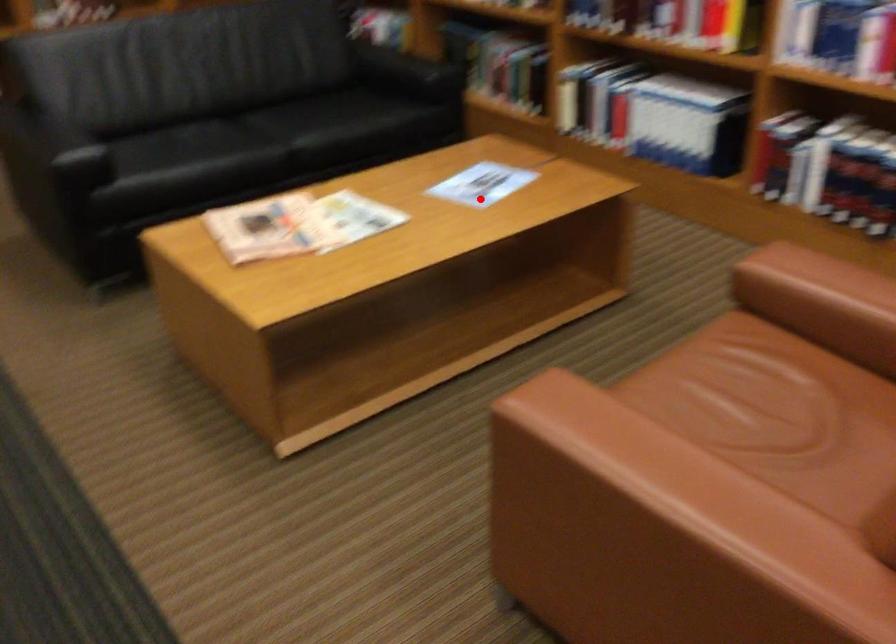
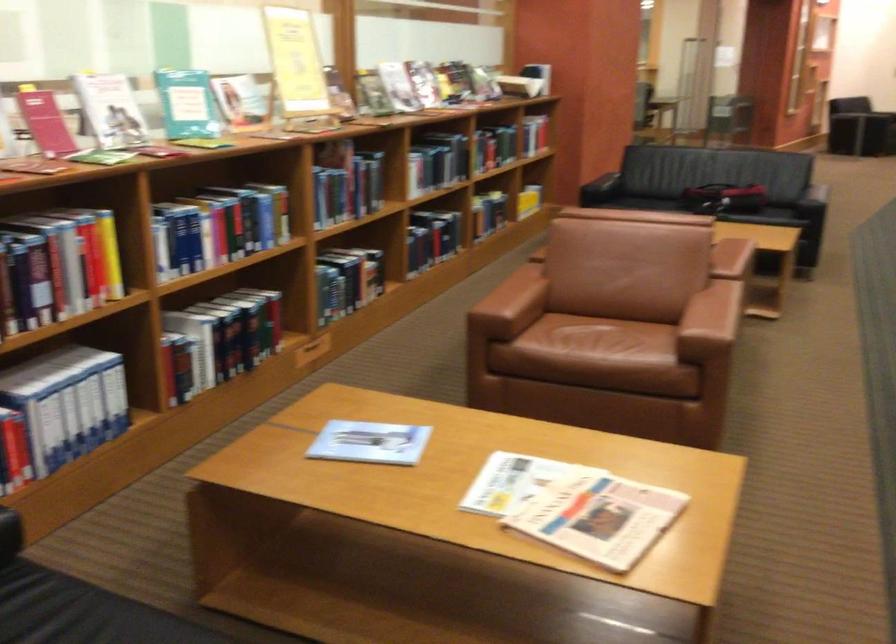
The point at the highlighted location is marked in the first image. Where is the corresponding point in the second image?

(369, 442)